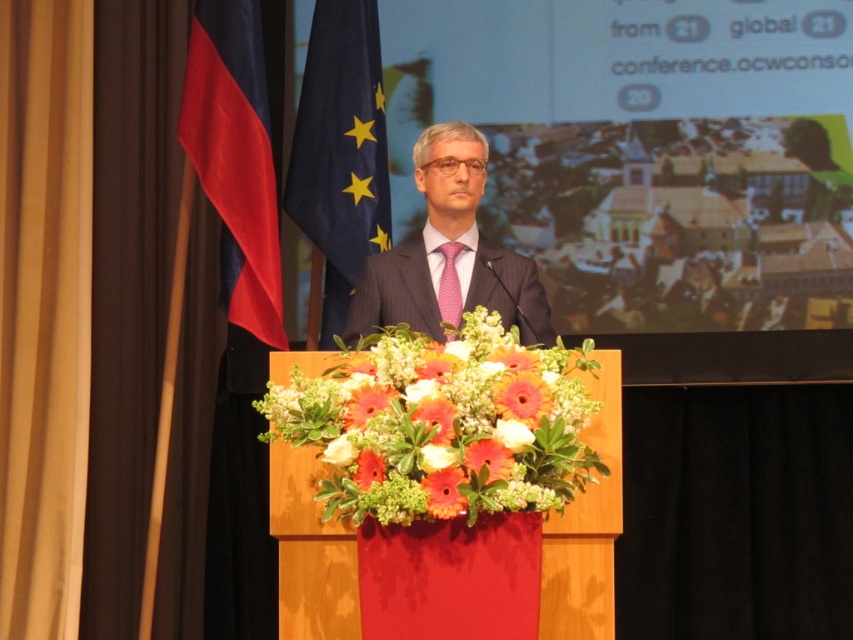
You are an event planner setting up for a ceremony. You need to ensure that the blue fabric flag at upper left and the orange matte flower at center are positioned correctly according to the event guidelines. Based on the scene description, which object is higher in the image?

The blue fabric flag at upper left is above the orange matte flower at center, so it is higher in the image.

You are an event planner setting up a stage for a formal speech. You need to ensure that the vibrant orange petals at center and the blue fabric flag at upper left are positioned correctly according to the event design guidelines. Based on the image, which object is placed lower in the scene?

The vibrant orange petals at center are placed lower than the blue fabric flag at upper left.

You are an event planner setting up for a formal event. You have a red fabric flag at left and a matte black suit at center. Based on the scene description, which object is positioned to the left of the other?

The red fabric flag at left is positioned to the left of the matte black suit at center.